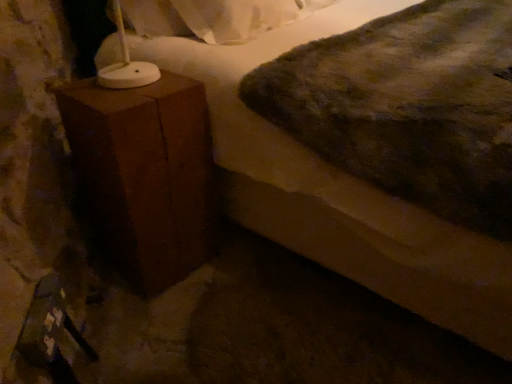
Identify the location of free space above brown wood side table at left (from a real-world perspective). (122, 90).